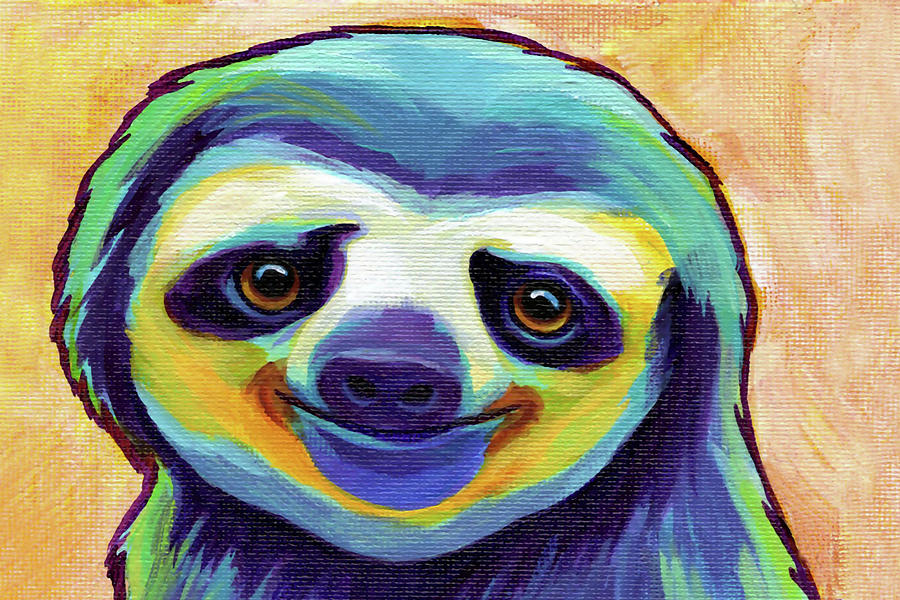
Where is `yellow color trim`? The image size is (900, 600). yellow color trim is located at coordinates 304,466.